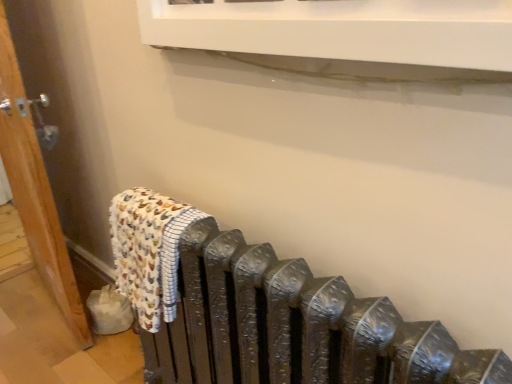
Question: In the image, is wooden door at left on the left side or the right side of printed cotton bath towel at left?

Choices:
 (A) right
 (B) left

Answer: (B)

Question: From the image's perspective, is wooden door at left positioned above or below printed cotton bath towel at left?

Choices:
 (A) above
 (B) below

Answer: (A)

Question: Relative to printed cotton bath towel at left, is wooden door at left in front or behind?

Choices:
 (A) behind
 (B) front

Answer: (A)

Question: From a real-world perspective, relative to wooden door at left, is printed cotton bath towel at left vertically above or below?

Choices:
 (A) above
 (B) below

Answer: (B)

Question: Considering the positions of printed cotton bath towel at left and wooden door at left in the image, is printed cotton bath towel at left wider or thinner than wooden door at left?

Choices:
 (A) thin
 (B) wide

Answer: (A)

Question: Relative to wooden door at left, is printed cotton bath towel at left in front or behind?

Choices:
 (A) front
 (B) behind

Answer: (A)

Question: Would you say printed cotton bath towel at left is inside or outside wooden door at left?

Choices:
 (A) outside
 (B) inside

Answer: (A)